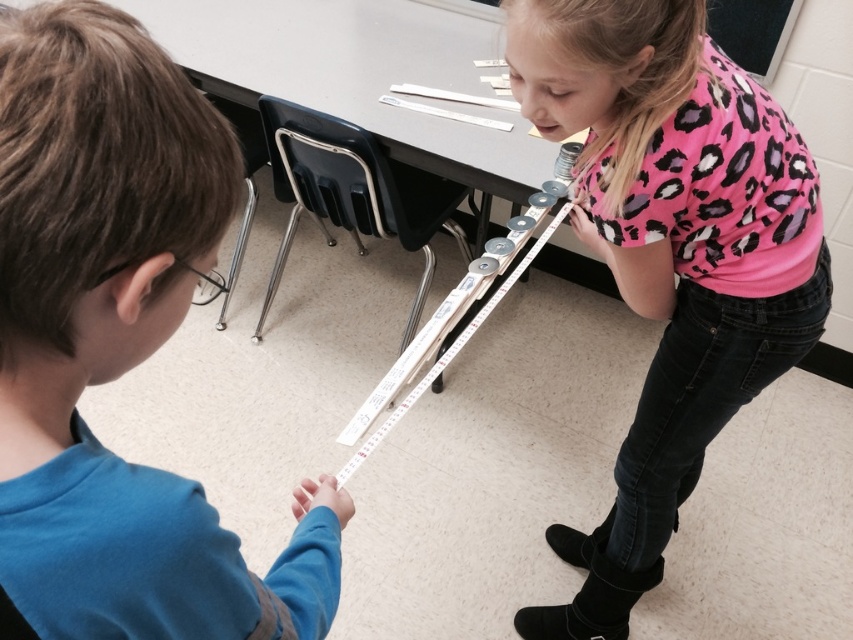
Question: Does blue fabric shirt at lower left have a lesser width compared to pink leopard print shirt at upper right?

Choices:
 (A) no
 (B) yes

Answer: (B)

Question: Can you confirm if blue fabric shirt at lower left is positioned above pink leopard print shirt at upper right?

Choices:
 (A) no
 (B) yes

Answer: (A)

Question: Is blue fabric shirt at lower left above pink leopard print shirt at upper right?

Choices:
 (A) no
 (B) yes

Answer: (A)

Question: Which of the following is the closest to the observer?

Choices:
 (A) blue fabric shirt at lower left
 (B) pink leopard print shirt at upper right

Answer: (A)